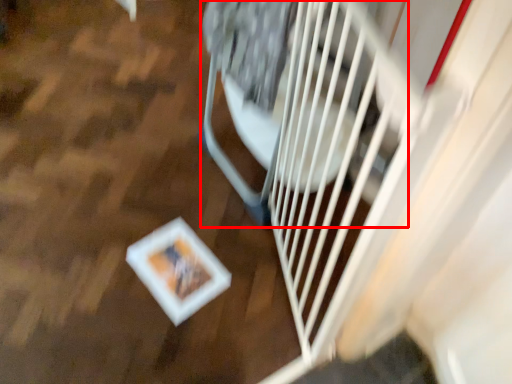
Question: From the image's perspective, what is the correct spatial positioning of wide (annotated by the red box) in reference to wood?

Choices:
 (A) above
 (B) below

Answer: (B)